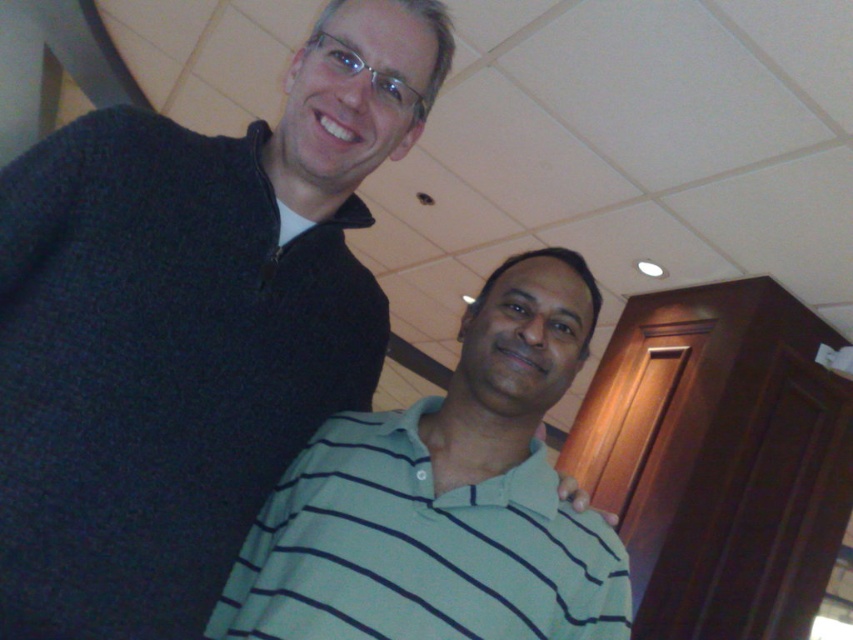
Who is positioned more to the right, dark blue sweater at upper left or light blue striped polo shirt at center?

From the viewer's perspective, light blue striped polo shirt at center appears more on the right side.

Which is in front, point (245, 352) or point (619, 609)?

Point (619, 609)

At what (x,y) coordinates should I click in order to perform the action: click on dark blue sweater at upper left. Please return your answer as a coordinate pair (x, y). This screenshot has height=640, width=853. Looking at the image, I should click on (189, 326).